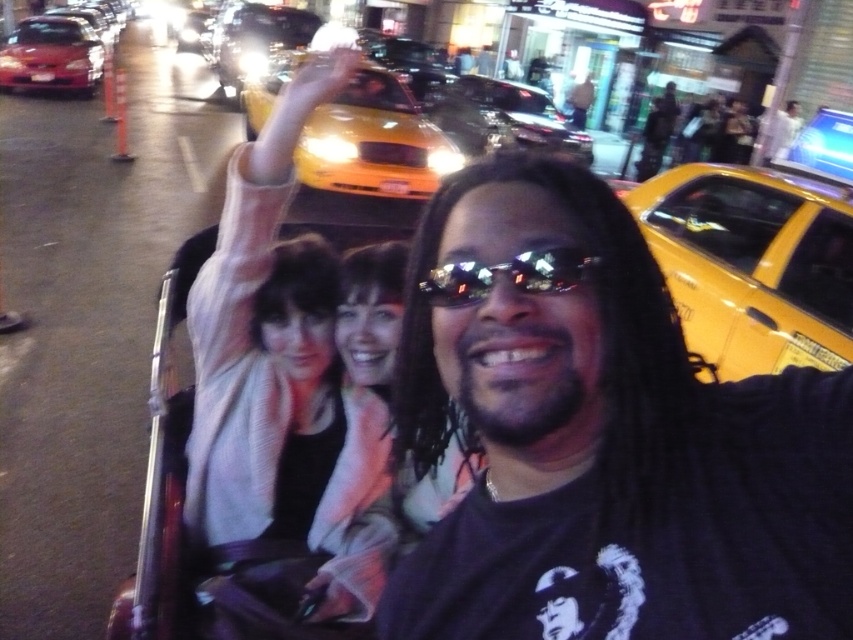
Between point (323, 390) and point (476, 90), which one is positioned behind?

Positioned behind is point (476, 90).

This screenshot has height=640, width=853. Identify the location of light pink fabric scarf at center. 283,381.

Does dark gray t-shirt at center lie behind shiny reflective sunglasses at center?

That is False.

Who is more distant from viewer, (x=717, y=384) or (x=438, y=280)?

Positioned behind is point (x=717, y=384).

You are a GUI agent. You are given a task and a screenshot of the screen. Output one action in this format:
    pyautogui.click(x=<x>, y=<y>)
    Task: Click on the dark gray t-shirt at center
    This screenshot has height=640, width=853.
    Given the screenshot: What is the action you would take?
    pyautogui.click(x=604, y=438)

Who is shorter, dark gray t-shirt at center or yellow taxi cab at center?

Standing shorter between the two is dark gray t-shirt at center.

Based on the photo, can you confirm if dark gray t-shirt at center is shorter than yellow taxi cab at center?

Correct, dark gray t-shirt at center is not as tall as yellow taxi cab at center.

Is point (669, 417) less distant than point (515, 93)?

Yes, point (669, 417) is closer to viewer.

Identify the location of dark gray t-shirt at center. (604, 438).